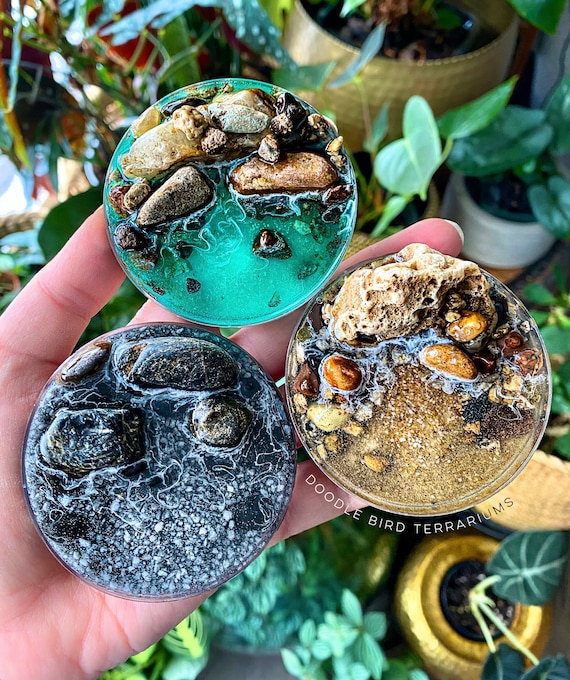
You are a GUI agent. You are given a task and a screenshot of the screen. Output one action in this format:
    pyautogui.click(x=<x>, y=<y>)
    Task: Click on the plant
    
    Given the screenshot: What is the action you would take?
    pyautogui.click(x=355, y=636)